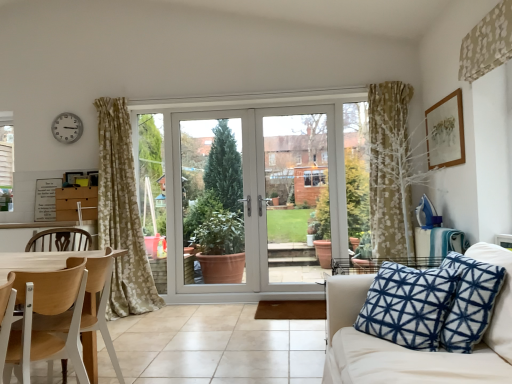
Find the location of a particular element. The width and height of the screenshot is (512, 384). white fabric couch at lower right is located at coordinates (413, 350).

What do you see at coordinates (445, 132) in the screenshot? Image resolution: width=512 pixels, height=384 pixels. I see `wooden picture frame at upper right` at bounding box center [445, 132].

You are a GUI agent. You are given a task and a screenshot of the screen. Output one action in this format:
    pyautogui.click(x=<x>, y=<y>)
    Task: Click on the clear glass door at center, arranged as the 2th screen door when viewed from the right
    
    Given the screenshot: What is the action you would take?
    pyautogui.click(x=215, y=202)

Describe the element at coordinates (215, 202) in the screenshot. I see `clear glass door at center, acting as the first screen door starting from the left` at that location.

At what (x,y) coordinates should I click in order to perform the action: click on beige floral fabric at upper right. Please return your answer as a coordinate pair (x, y). The image size is (512, 384). Looking at the image, I should click on (487, 43).

At what (x,y) coordinates should I click in order to perform the action: click on white fabric couch at lower right. Please return your answer as a coordinate pair (x, y). The height and width of the screenshot is (384, 512). Looking at the image, I should click on (413, 350).

From a real-world perspective, is wooden picture frame at upper right above or below white fabric couch at lower right?

From a real-world perspective, wooden picture frame at upper right is physically above white fabric couch at lower right.

Is wooden picture frame at upper right inside the boundaries of white fabric couch at lower right, or outside?

wooden picture frame at upper right is located beyond the bounds of white fabric couch at lower right.

Is wooden picture frame at upper right smaller than white fabric couch at lower right?

Correct, wooden picture frame at upper right occupies less space than white fabric couch at lower right.

Based on their positions, is clear glass door at center, acting as the first screen door starting from the left, located to the left or right of wooden picture frame at upper right?

Based on their positions, clear glass door at center, acting as the first screen door starting from the left, is located to the left of wooden picture frame at upper right.

From a real-world perspective, does clear glass door at center, acting as the first screen door starting from the left, sit lower than wooden picture frame at upper right?

Yes, from a real-world perspective, clear glass door at center, acting as the first screen door starting from the left, is under wooden picture frame at upper right.

Which of these two, clear glass door at center, acting as the first screen door starting from the left, or wooden picture frame at upper right, is wider?

clear glass door at center, acting as the first screen door starting from the left.

Can you tell me how much clear glass door at center, acting as the first screen door starting from the left, and wooden picture frame at upper right differ in facing direction?

The angular difference between clear glass door at center, acting as the first screen door starting from the left, and wooden picture frame at upper right is 89 degrees.

Considering the relative sizes of beige floral fabric at upper right and clear glass door at center, the second screen door from the left, in the image provided, is beige floral fabric at upper right shorter than clear glass door at center, the second screen door from the left,?

Yes.

From the image's perspective, which object appears higher, beige floral fabric at upper right or clear glass door at center, acting as the first screen door starting from the right?

beige floral fabric at upper right.

From a real-world perspective, does beige floral fabric at upper right stand above clear glass door at center, the second screen door from the left?

Indeed, from a real-world perspective, beige floral fabric at upper right stands above clear glass door at center, the second screen door from the left.

Is beige floral fabric at upper right inside the boundaries of clear glass door at center, acting as the first screen door starting from the right, or outside?

beige floral fabric at upper right is not enclosed by clear glass door at center, acting as the first screen door starting from the right.

Between clear glass door at center, acting as the first screen door starting from the right, and white plastic door at center, which one has smaller width?

With smaller width is clear glass door at center, acting as the first screen door starting from the right.

Could white plastic door at center be considered to be inside clear glass door at center, the second screen door from the left?

No.

The image size is (512, 384). Find the location of `door that appears on the left of clear glass door at center, the second screen door from the left`. door that appears on the left of clear glass door at center, the second screen door from the left is located at coordinates (254, 197).

Measure the distance between clear glass door at center, the second screen door from the left, and white plastic door at center.

clear glass door at center, the second screen door from the left, and white plastic door at center are 19.39 centimeters apart.

From a real-world perspective, is beige floral fabric at upper right physically located above or below matte silver clock at upper left?

beige floral fabric at upper right is situated higher than matte silver clock at upper left in the real world.

Is beige floral fabric at upper right next to matte silver clock at upper left?

There is a gap between beige floral fabric at upper right and matte silver clock at upper left.

Can you confirm if beige floral fabric at upper right is smaller than matte silver clock at upper left?

No, beige floral fabric at upper right is not smaller than matte silver clock at upper left.

Identify the location of curtain above the matte silver clock at upper left (from a real-world perspective). The height and width of the screenshot is (384, 512). (487, 43).

Considering the sizes of objects wooden chair at left and white plastic door at center in the image provided, who is smaller, wooden chair at left or white plastic door at center?

With smaller size is white plastic door at center.

Does wooden chair at left appear on the right side of white plastic door at center?

No.

Could you tell me if wooden chair at left is facing white plastic door at center?

No, wooden chair at left does not turn towards white plastic door at center.

From the image's perspective, is wooden chair at left over white plastic door at center?

Actually, wooden chair at left appears below white plastic door at center in the image.

From a real-world perspective, relative to white fabric couch at lower right, is clear glass door at center, acting as the first screen door starting from the left, vertically above or below?

clear glass door at center, acting as the first screen door starting from the left, is above white fabric couch at lower right.

Considering the points (233, 133) and (382, 344), which point is behind, point (233, 133) or point (382, 344)?

The point (233, 133) is more distant.

Between clear glass door at center, acting as the first screen door starting from the left, and white fabric couch at lower right, which one appears on the right side from the viewer's perspective?

Positioned to the right is white fabric couch at lower right.

Considering the relative sizes of clear glass door at center, acting as the first screen door starting from the left, and white fabric couch at lower right in the image provided, is clear glass door at center, acting as the first screen door starting from the left, shorter than white fabric couch at lower right?

In fact, clear glass door at center, acting as the first screen door starting from the left, may be taller than white fabric couch at lower right.

Locate an element on the screen. This screenshot has width=512, height=384. studio couch below the wooden picture frame at upper right (from a real-world perspective) is located at coordinates (413, 350).

I want to click on picture frame lying on the right of clear glass door at center, acting as the first screen door starting from the left, so click(x=445, y=132).

From the picture: When comparing their distances from beige floral fabric at upper right, does matte silver clock at upper left or wooden chair at left seem further?

matte silver clock at upper left is further to beige floral fabric at upper right.

From the image, which object appears to be nearer to beige floral fabric at upper right, white fabric couch at lower right or white plastic door at center?

white fabric couch at lower right.

Looking at the image, which one is located closer to clear glass door at center, the second screen door from the left, clear glass door at center, arranged as the 2th screen door when viewed from the right, or wooden picture frame at upper right?

Based on the image, clear glass door at center, arranged as the 2th screen door when viewed from the right, appears to be nearer to clear glass door at center, the second screen door from the left.

Which object lies nearer to the anchor point clear glass door at center, arranged as the 2th screen door when viewed from the right, clear glass door at center, acting as the first screen door starting from the right, or white fabric couch at lower right?

clear glass door at center, acting as the first screen door starting from the right, lies closer to clear glass door at center, arranged as the 2th screen door when viewed from the right, than the other object.

Considering their positions, is wooden chair at left positioned further to white fabric couch at lower right than clear glass door at center, acting as the first screen door starting from the right?

clear glass door at center, acting as the first screen door starting from the right, lies further to white fabric couch at lower right than the other object.

Looking at this image, which object lies nearer to the anchor point wooden chair at left, white plastic door at center or matte silver clock at upper left?

matte silver clock at upper left is positioned closer to the anchor wooden chair at left.

Considering their positions, is matte silver clock at upper left positioned closer to clear glass door at center, acting as the first screen door starting from the right, than clear glass door at center, acting as the first screen door starting from the left?

clear glass door at center, acting as the first screen door starting from the left, is positioned closer to the anchor clear glass door at center, acting as the first screen door starting from the right.

When comparing their distances from wooden picture frame at upper right, does beige floral fabric at upper right or white plastic door at center seem further?

Based on the image, white plastic door at center appears to be further to wooden picture frame at upper right.

Locate an element on the screen. Image resolution: width=512 pixels, height=384 pixels. picture frame between white fabric couch at lower right and clear glass door at center, acting as the first screen door starting from the left, from front to back is located at coordinates (445, 132).

Image resolution: width=512 pixels, height=384 pixels. I want to click on door located between beige floral fabric at upper right and clear glass door at center, arranged as the 2th screen door when viewed from the right, in the depth direction, so click(254, 197).

Where is `door between white fabric couch at lower right and clear glass door at center, the second screen door from the left, in the front-back direction`? door between white fabric couch at lower right and clear glass door at center, the second screen door from the left, in the front-back direction is located at coordinates (254, 197).

The image size is (512, 384). Find the location of `screen door positioned between beige floral fabric at upper right and clear glass door at center, acting as the first screen door starting from the left, from near to far`. screen door positioned between beige floral fabric at upper right and clear glass door at center, acting as the first screen door starting from the left, from near to far is located at coordinates (296, 194).